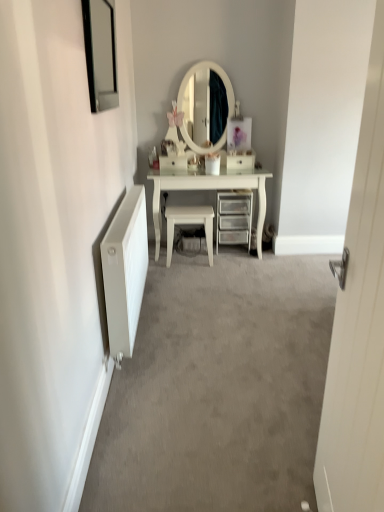
Where is `empty space that is to the right of white glossy stool at center`? The image size is (384, 512). empty space that is to the right of white glossy stool at center is located at coordinates (228, 264).